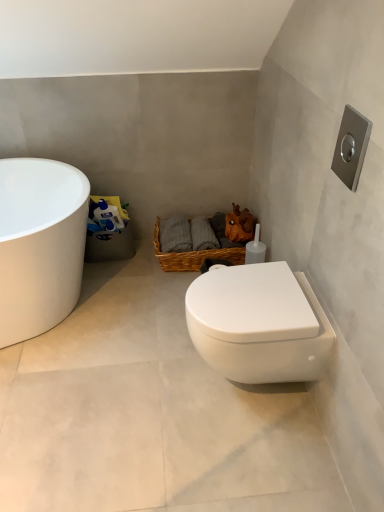
This screenshot has height=512, width=384. I want to click on blank area to the left of woven brown basket at center, so tap(134, 276).